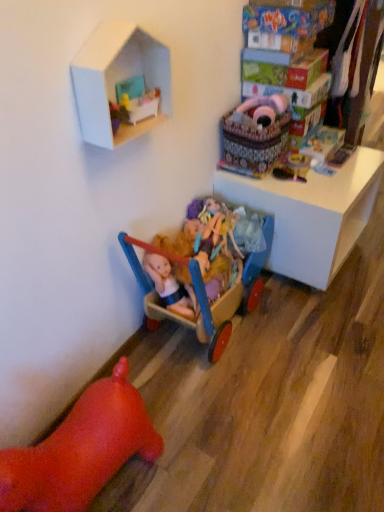
What are the coordinates of `empty space that is to the right of wooden toy at center, the sixth toy viewed from the left` in the screenshot? It's located at (352, 170).